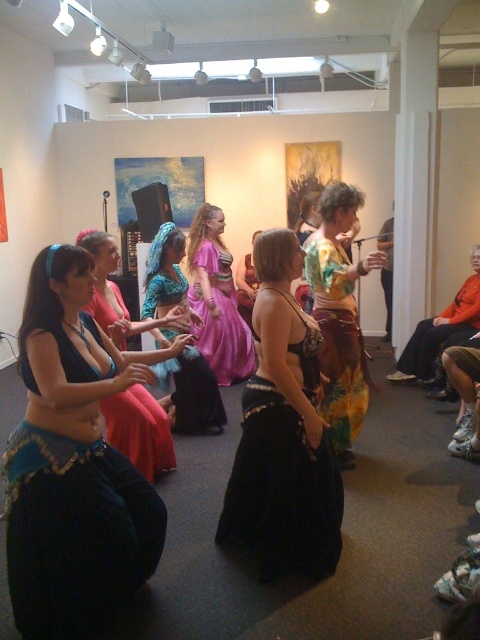
Question: Can you confirm if black satin skirt at center is positioned below shiny blue fabric belly dancer at center?

Choices:
 (A) yes
 (B) no

Answer: (A)

Question: Does blue satin belly dancer at center have a smaller size compared to orange fabric skirt at right?

Choices:
 (A) no
 (B) yes

Answer: (B)

Question: Which of the following is the farthest from the observer?

Choices:
 (A) (95, 602)
 (B) (348, 337)

Answer: (B)

Question: Which point is farther to the camera?

Choices:
 (A) (147, 291)
 (B) (408, 372)
 (C) (81, 243)

Answer: (B)

Question: Which object appears farthest from the camera in this image?

Choices:
 (A) orange fabric skirt at right
 (B) shiny blue fabric belly dancer at center
 (C) purple satin dress at center
 (D) floral fabric skirt at center

Answer: (C)

Question: Does shiny blue fabric belly dancer at center appear under purple satin dress at center?

Choices:
 (A) no
 (B) yes

Answer: (B)